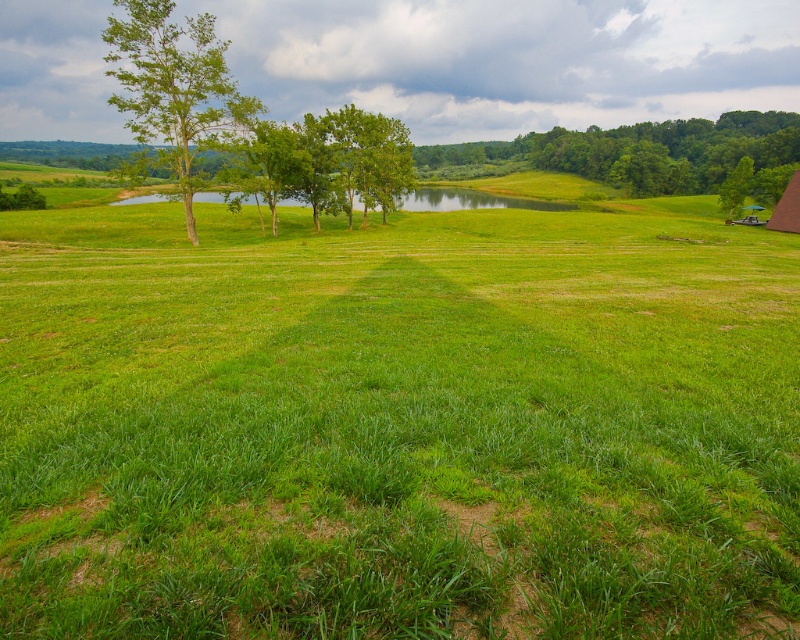
You are a landscape photographer planning to capture the entire green grassy field at center and the green leafy trees at center in a single shot. Given that your camera has a limited field of view, which object should you prioritize framing first to ensure both are visible?

The green grassy field at center is bigger than the green leafy trees at center, so you should prioritize framing the larger green grassy field at center first to accommodate its size while still fitting the smaller green leafy trees at center into the shot.

From the picture: You are standing at the center of the field looking towards the horizon. Which direction should you walk to reach the green leafy tree at center?

The green leafy tree at center is located at coordinates 0.241 on the x and 0.799 on the y axis, so you should walk towards the center of the field to reach it.